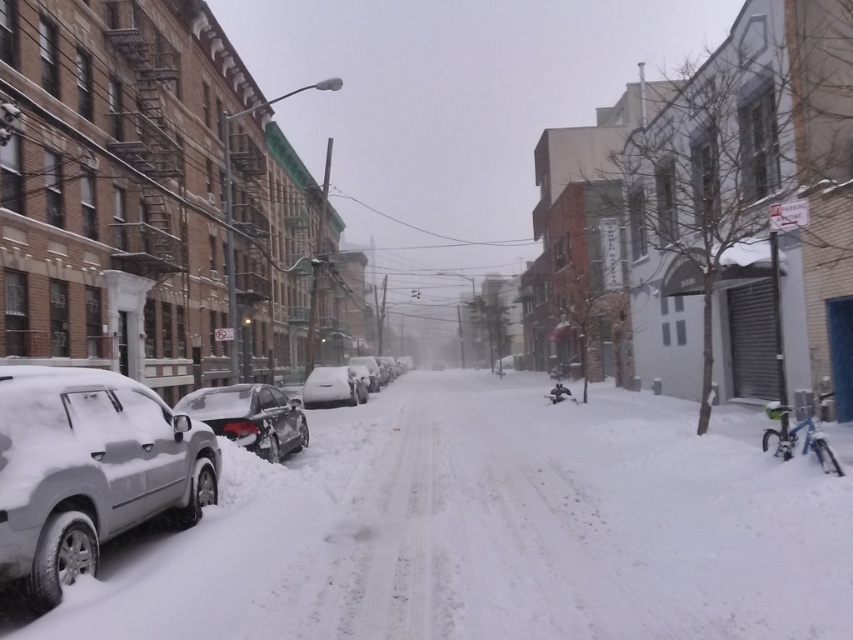
Is white fluffy snow at lower left to the right of white matte car at center from the viewer's perspective?

Correct, you'll find white fluffy snow at lower left to the right of white matte car at center.

From the picture: Does white fluffy snow at lower left have a lesser height compared to white matte car at center?

No.

What do you see at coordinates (492, 529) in the screenshot? Image resolution: width=853 pixels, height=640 pixels. I see `white fluffy snow at lower left` at bounding box center [492, 529].

You are a GUI agent. You are given a task and a screenshot of the screen. Output one action in this format:
    pyautogui.click(x=<x>, y=<y>)
    Task: Click on the white fluffy snow at lower left
    The height and width of the screenshot is (640, 853).
    Given the screenshot: What is the action you would take?
    pyautogui.click(x=492, y=529)

Based on the photo, does sleek silver suv at left have a lesser height compared to white matte car at center?

Incorrect, sleek silver suv at left's height does not fall short of white matte car at center's.

What do you see at coordinates (90, 468) in the screenshot?
I see `sleek silver suv at left` at bounding box center [90, 468].

Find the location of `sleek silver suv at left`. sleek silver suv at left is located at coordinates (90, 468).

Can you confirm if sleek silver suv at left is shorter than sleek metallic car at lower left?

Incorrect, sleek silver suv at left's height does not fall short of sleek metallic car at lower left's.

Between point (154, 417) and point (242, 422), which one is positioned behind?

The point (242, 422) is more distant.

Where is `sleek silver suv at left`? The height and width of the screenshot is (640, 853). sleek silver suv at left is located at coordinates (90, 468).